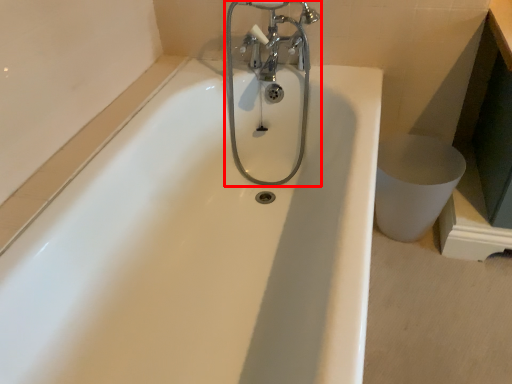
Question: From the image's perspective, where is tap (annotated by the red box) located relative to toilet bowl?

Choices:
 (A) below
 (B) above

Answer: (B)